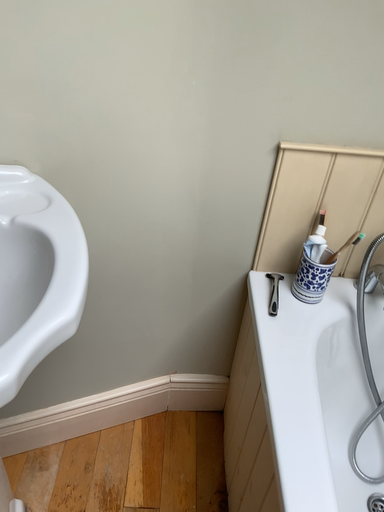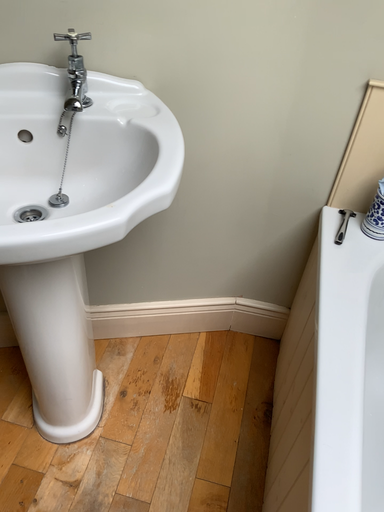
Question: How did the camera likely rotate when shooting the video?

Choices:
 (A) rotated left
 (B) rotated right

Answer: (A)